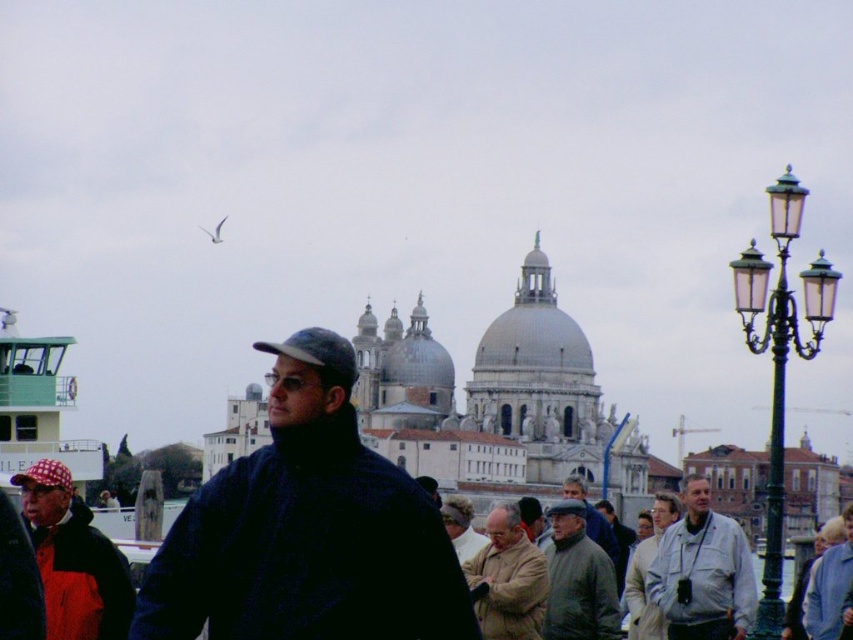
Consider the image. You are a photographer trying to capture a photo of the domed building in the background. You notice the green metal lamp post at right and the checkered fabric baseball cap at left in your shot. Which object might block your view of the domed building if positioned closer to the camera?

The green metal lamp post at right is much taller than the checkered fabric baseball cap at left, so it is more likely to block the view of the domed building if positioned closer to the camera.

You are a photographer trying to capture the Basilica di Santa Maria della Salute in the background. You notice the green metal lamp post at right and the checkered fabric baseball cap at left in your frame. Which object is wider and might block your view of the basilica if not positioned carefully?

The green metal lamp post at right is wider than the checkered fabric baseball cap at left, so it might block the view of the basilica if not positioned carefully.

You are standing in the waterfront scene and want to take a photo of the green metal lamp post at right and the checkered fabric baseball cap at left. Which object should you frame first in your camera viewfinder to ensure both are in the shot?

You should frame the checkered fabric baseball cap at left first because the green metal lamp post at right is to the right of it, so positioning the cap first ensures both objects are included in the photo.